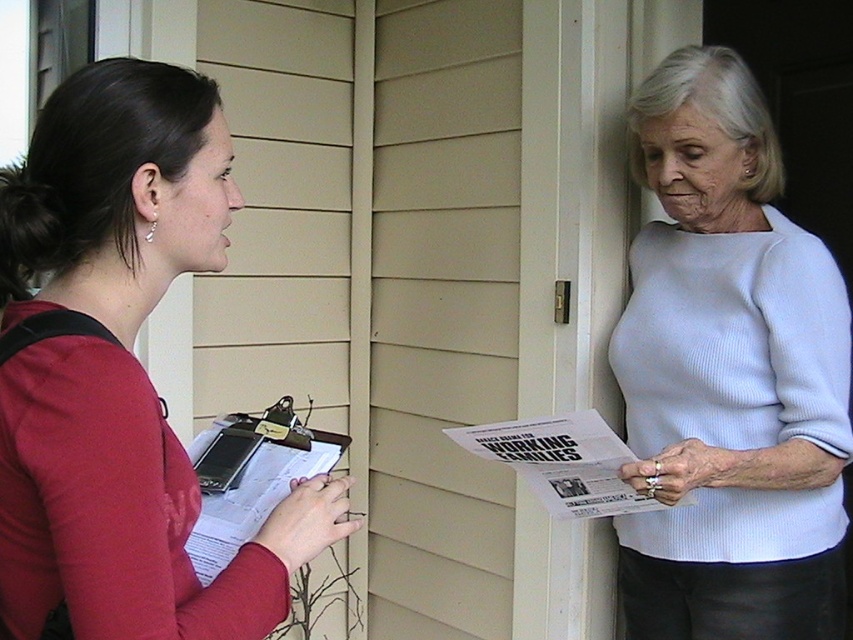
Question: Is matte red shirt at left further to the viewer compared to white glossy paper at center?

Choices:
 (A) no
 (B) yes

Answer: (A)

Question: Which object is farther from the camera taking this photo?

Choices:
 (A) light blue ribbed sweater at upper right
 (B) white glossy paper at center
 (C) matte red shirt at left

Answer: (A)

Question: Can you confirm if light blue ribbed sweater at upper right is positioned to the right of white glossy paper at center?

Choices:
 (A) yes
 (B) no

Answer: (A)

Question: Which object is closer to the camera taking this photo?

Choices:
 (A) light blue ribbed sweater at upper right
 (B) matte red shirt at left

Answer: (B)

Question: Among these objects, which one is nearest to the camera?

Choices:
 (A) white glossy paper at center
 (B) matte red shirt at left

Answer: (B)

Question: Where is light blue ribbed sweater at upper right located in relation to white glossy paper at center in the image?

Choices:
 (A) below
 (B) above

Answer: (B)